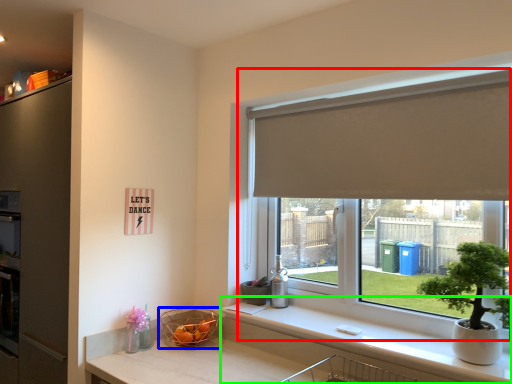
Question: Which object is positioned farthest from window (highlighted by a red box)? Select from basket (highlighted by a blue box) and counter top (highlighted by a green box).

Choices:
 (A) basket
 (B) counter top

Answer: (A)